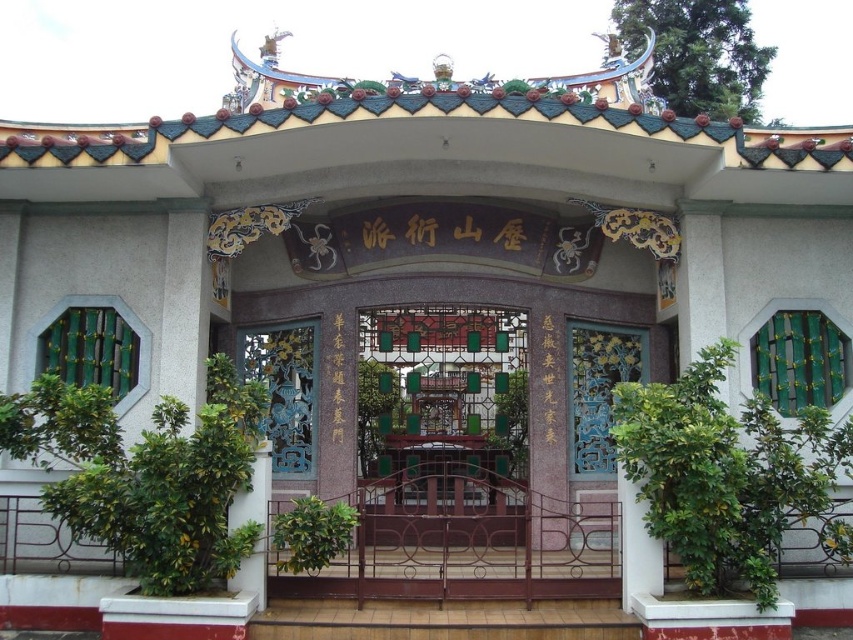
Consider the image. Is blue painted wood gate at center smaller than white marble pillar at lower left?

Indeed, blue painted wood gate at center has a smaller size compared to white marble pillar at lower left.

Locate an element on the screen. blue painted wood gate at center is located at coordinates (285, 390).

Measure the distance between point (288, 372) and camera.

Point (288, 372) and camera are 40.38 meters apart.

Identify the location of blue painted wood gate at center. The width and height of the screenshot is (853, 640). (285, 390).

Does blue painted wood gate at center appear on the left side of blue carved wood door at right?

Indeed, blue painted wood gate at center is positioned on the left side of blue carved wood door at right.

From the picture: Who is more forward, (271, 392) or (578, 474)?

Positioned in front is point (578, 474).

The height and width of the screenshot is (640, 853). What are the coordinates of `blue painted wood gate at center` in the screenshot? It's located at (285, 390).

Can you confirm if blue carved wood door at right is shorter than white marble pillar at lower left?

Yes, blue carved wood door at right is shorter than white marble pillar at lower left.

Is point (583, 404) positioned behind point (227, 524)?

Yes, point (583, 404) is farther from viewer.

Where is `blue carved wood door at right`? This screenshot has width=853, height=640. blue carved wood door at right is located at coordinates (599, 388).